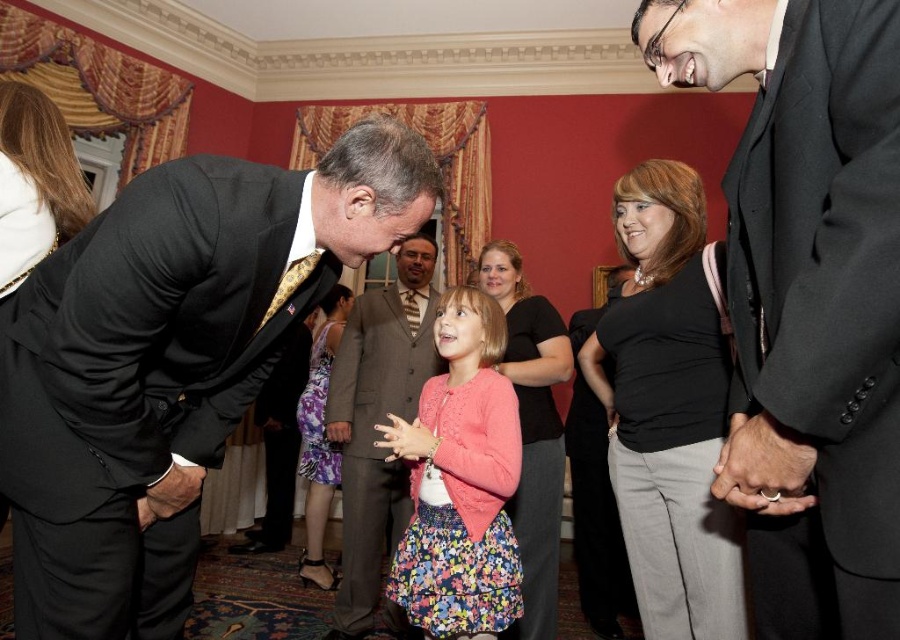
Can you confirm if pink fabric dress at center is wider than matte brown suit at center?

In fact, pink fabric dress at center might be narrower than matte brown suit at center.

Where is `pink fabric dress at center`? This screenshot has height=640, width=900. pink fabric dress at center is located at coordinates (460, 483).

Measure the distance between black suit at center and camera.

black suit at center is 36.98 inches away from camera.

Does black suit at center have a smaller size compared to matte brown suit at center?

Indeed, black suit at center has a smaller size compared to matte brown suit at center.

This screenshot has width=900, height=640. What are the coordinates of `black suit at center` in the screenshot? It's located at (807, 298).

Who is lower down, black suit at center or pink fabric dress at center?

pink fabric dress at center is below.

Does black suit at center have a greater width compared to pink fabric dress at center?

Incorrect, black suit at center's width does not surpass pink fabric dress at center's.

Is point (760, 352) positioned after point (459, 556)?

No, it is not.

Image resolution: width=900 pixels, height=640 pixels. I want to click on black suit at center, so click(x=807, y=298).